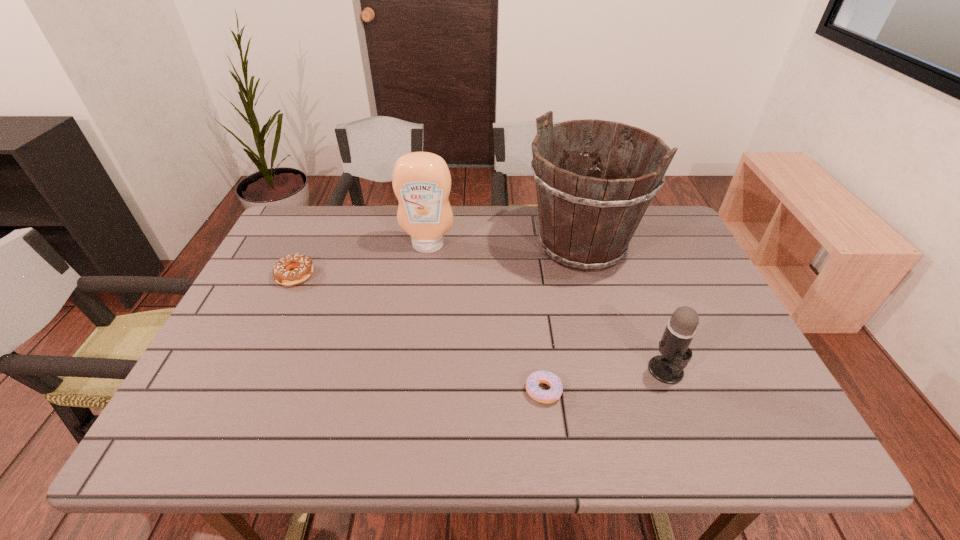
Where is `free spot between the leftmost object and the third tallest object`? This screenshot has height=540, width=960. free spot between the leftmost object and the third tallest object is located at coordinates (481, 323).

Identify the location of free spot between the bucket and the second tallest object. (505, 246).

Find the location of a particular element. The width and height of the screenshot is (960, 540). free space between the right doughnut and the second object from left to right is located at coordinates (486, 318).

Identify the location of free space between the condiment and the shorter doughnut. (486, 318).

This screenshot has width=960, height=540. I want to click on the third closest object to the leftmost object, so click(534, 391).

The width and height of the screenshot is (960, 540). Identify the location of object that can be found as the fourth closest to the third shortest object. (283, 274).

I want to click on vacant region that satisfies the following two spatial constraints: 1. on the label of the condiment; 2. on the left side of the nearer doughnut, so pos(407,390).

Where is `free space that satisfies the following two spatial constraints: 1. on the front side of the bucket; 2. on the left side of the third shortest object`? The height and width of the screenshot is (540, 960). free space that satisfies the following two spatial constraints: 1. on the front side of the bucket; 2. on the left side of the third shortest object is located at coordinates (616, 370).

You are a GUI agent. You are given a task and a screenshot of the screen. Output one action in this format:
    pyautogui.click(x=<x>, y=<y>)
    Task: Click on the free spot that satisfies the following two spatial constraints: 1. on the label of the nearer doughnut; 2. on the left side of the fourth shortest object
    This screenshot has height=540, width=960.
    Given the screenshot: What is the action you would take?
    pyautogui.click(x=407, y=390)

Locate an element on the screen. The width and height of the screenshot is (960, 540). free space in the image that satisfies the following two spatial constraints: 1. on the label of the shortest object; 2. on the right side of the condiment is located at coordinates (407, 390).